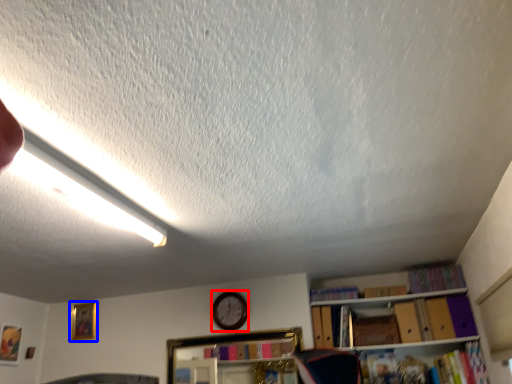
Question: Among these objects, which one is farthest to the camera, clock (highlighted by a red box) or picture frame (highlighted by a blue box)?

Choices:
 (A) clock
 (B) picture frame

Answer: (B)